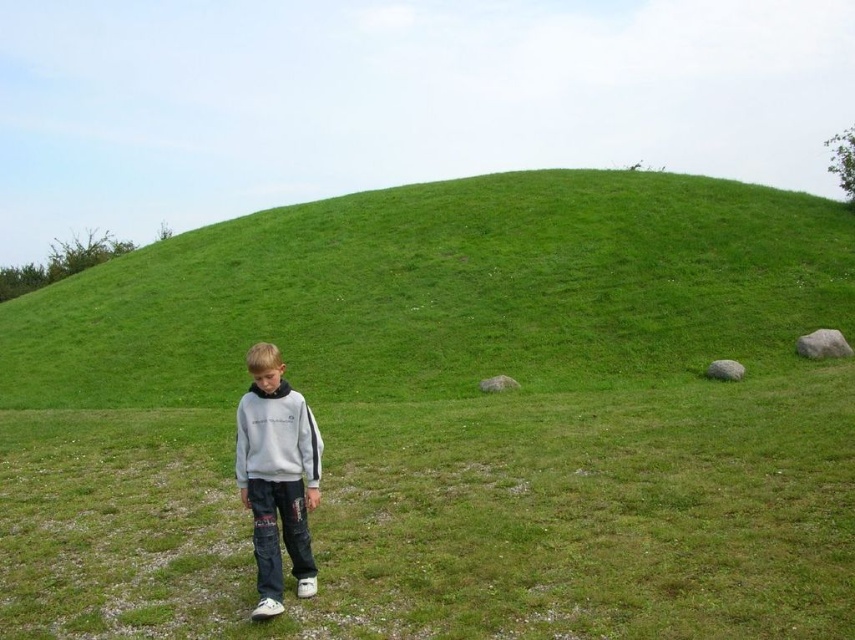
Question: Is green grassy hillside at center wider than gray cotton sweatshirt at center?

Choices:
 (A) yes
 (B) no

Answer: (A)

Question: Which of the following is the farthest from the observer?

Choices:
 (A) (301, 586)
 (B) (270, 408)
 (C) (797, 314)

Answer: (C)

Question: Which object is farther from the camera taking this photo?

Choices:
 (A) green grassy hillside at center
 (B) gray fleece sweatshirt at center
 (C) gray cotton sweatshirt at center

Answer: (A)

Question: Considering the relative positions of green grassy hillside at center and gray fleece sweatshirt at center in the image provided, where is green grassy hillside at center located with respect to gray fleece sweatshirt at center?

Choices:
 (A) below
 (B) above

Answer: (B)

Question: Which point is farther from the camera taking this photo?

Choices:
 (A) (258, 614)
 (B) (255, 442)

Answer: (B)

Question: Is green grassy hillside at center bigger than gray cotton sweatshirt at center?

Choices:
 (A) yes
 (B) no

Answer: (A)